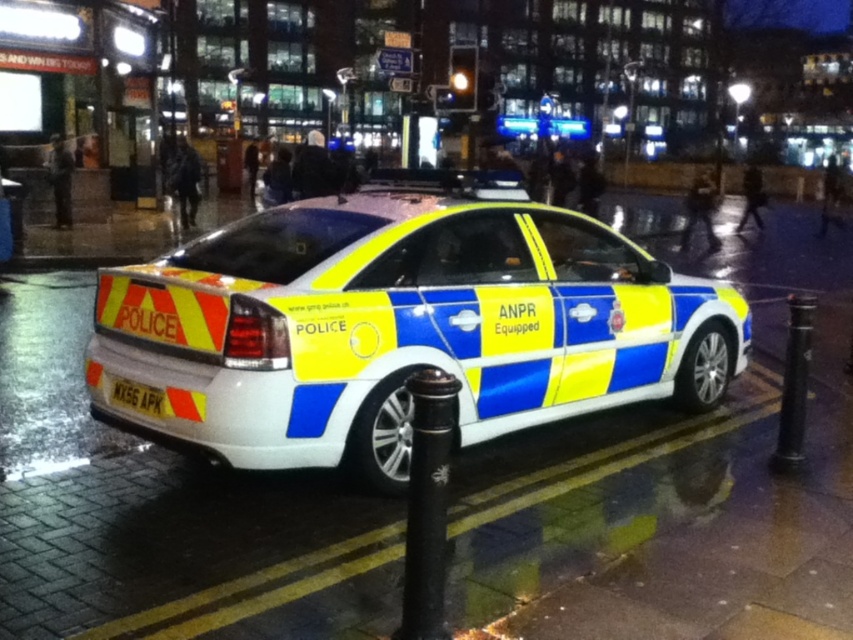
Question: Is black metal pole at center wider than white plastic license plate at lower left?

Choices:
 (A) yes
 (B) no

Answer: (B)

Question: Can you confirm if yellow/blue checkered police car at center is positioned to the left of white plastic license plate at lower left?

Choices:
 (A) yes
 (B) no

Answer: (B)

Question: Estimate the real-world distances between objects in this image. Which object is farther from the yellow/blue checkered police car at center?

Choices:
 (A) black metal pole at center
 (B) white plastic license plate at lower left

Answer: (A)

Question: Which object appears closest to the camera in this image?

Choices:
 (A) white plastic license plate at lower left
 (B) yellow/blue checkered police car at center

Answer: (B)

Question: In this image, where is yellow/blue checkered police car at center located relative to white plastic license plate at lower left?

Choices:
 (A) above
 (B) below

Answer: (A)

Question: Which object appears farthest from the camera in this image?

Choices:
 (A) white plastic license plate at lower left
 (B) yellow/blue checkered police car at center
 (C) black metal pole at center

Answer: (A)